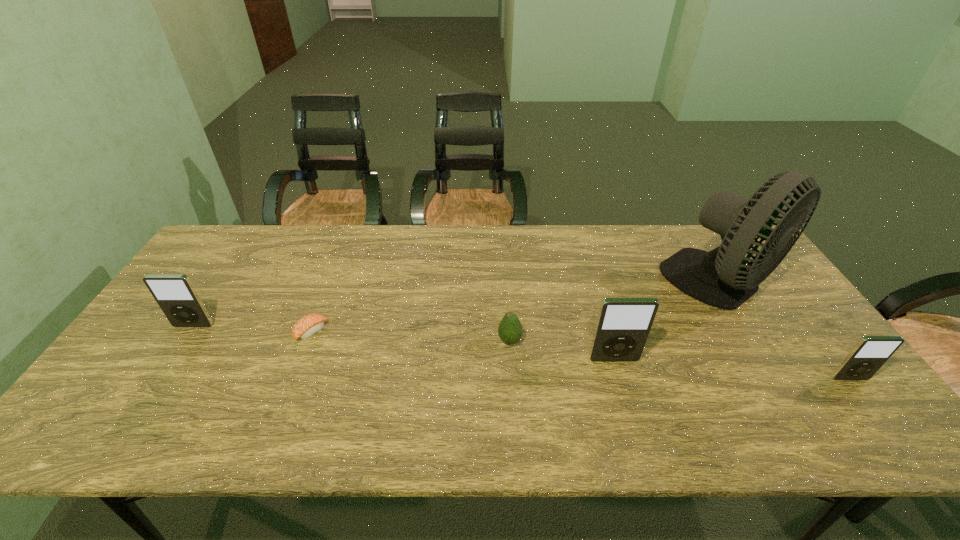
You are a GUI agent. You are given a task and a screenshot of the screen. Output one action in this format:
    pyautogui.click(x=<x>, y=<y>)
    Task: Click on the fan that is at the right edge
    This screenshot has height=540, width=960.
    Given the screenshot: What is the action you would take?
    (x=720, y=278)

Locate an element on the screen. object that is at the far right corner is located at coordinates (720, 278).

Where is `object that is at the near right corner`? The height and width of the screenshot is (540, 960). object that is at the near right corner is located at coordinates (870, 353).

The width and height of the screenshot is (960, 540). What are the coordinates of `vacant space at the far edge` in the screenshot? It's located at (327, 238).

You are a GUI agent. You are given a task and a screenshot of the screen. Output one action in this format:
    pyautogui.click(x=<x>, y=<y>)
    Task: Click on the vacant area at the near edge of the desktop
    This screenshot has width=960, height=540.
    Given the screenshot: What is the action you would take?
    pyautogui.click(x=181, y=382)

This screenshot has height=540, width=960. In order to click on vacant region at the left edge of the desktop in this screenshot , I will do `click(236, 279)`.

Where is `free spot at the right edge of the desktop`? This screenshot has width=960, height=540. free spot at the right edge of the desktop is located at coordinates (747, 316).

This screenshot has height=540, width=960. I want to click on free region at the far left corner of the desktop, so click(x=257, y=228).

The height and width of the screenshot is (540, 960). Find the location of `vacant area between the tallest object and the farthest iPod`. vacant area between the tallest object and the farthest iPod is located at coordinates (458, 305).

Locate an element on the screen. The image size is (960, 540). unoccupied position between the fan and the nearest iPod is located at coordinates (785, 332).